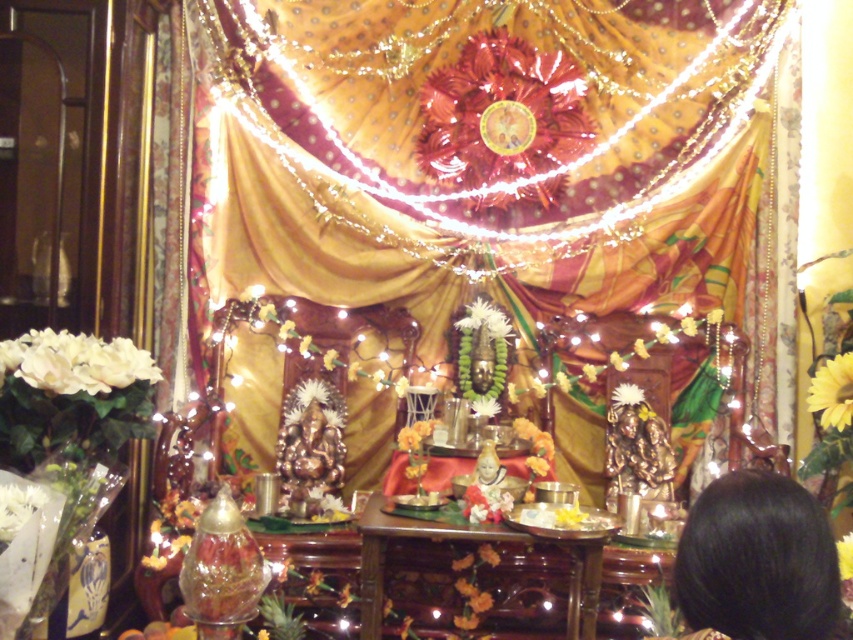
Question: Among these objects, which one is nearest to the camera?

Choices:
 (A) black hair at lower right
 (B) yellow matte flower at upper right
 (C) white matte flower at center

Answer: (A)

Question: Which of the following is the farthest from the observer?

Choices:
 (A) (833, 412)
 (B) (732, 529)

Answer: (A)

Question: Estimate the real-world distances between objects in this image. Which object is farther from the white matte flower at center?

Choices:
 (A) white silk flower at center
 (B) wooden table at center
 (C) gold satin curtain at upper center
 (D) yellow matte flower at upper right

Answer: (D)

Question: Can you confirm if wooden table at center is thinner than white matte flowers at left?

Choices:
 (A) yes
 (B) no

Answer: (B)

Question: Considering the relative positions of black hair at lower right and white matte flowers at left in the image provided, where is black hair at lower right located with respect to white matte flowers at left?

Choices:
 (A) left
 (B) right

Answer: (B)

Question: Can you confirm if gold satin curtain at upper center is positioned below black hair at lower right?

Choices:
 (A) yes
 (B) no

Answer: (B)